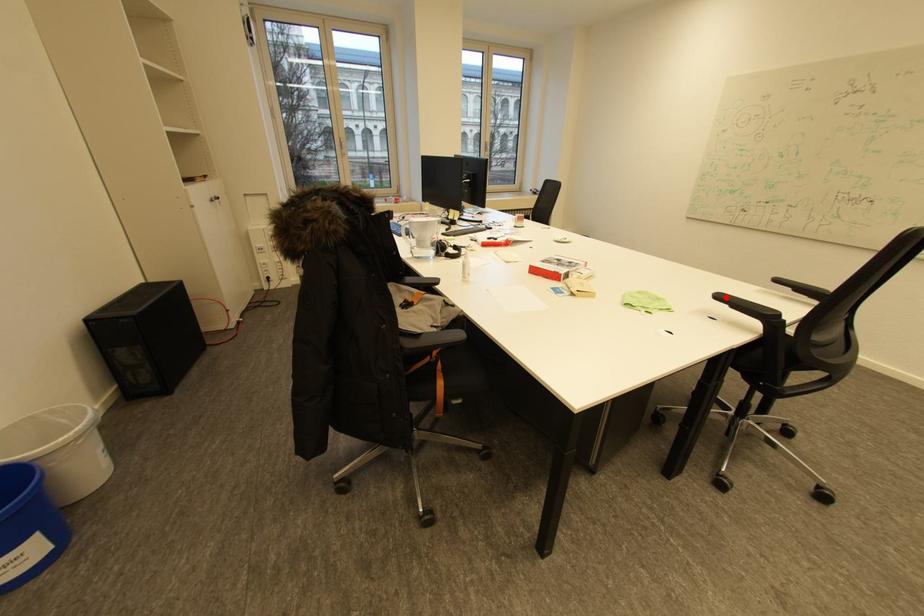
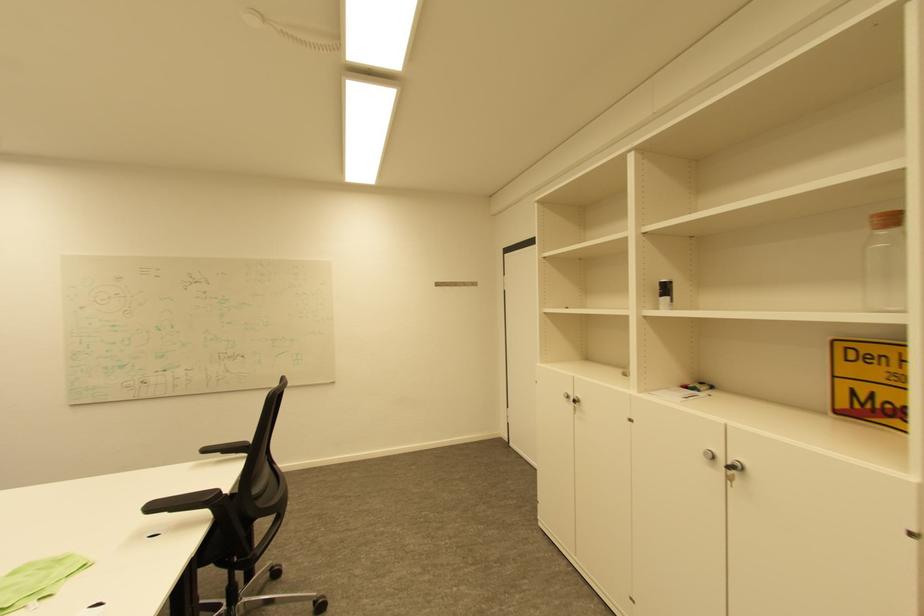
Question: I am providing you with two images of the same scene from different viewpoints. Image1 has a red point marked. In image2, the corresponding 3D location appears at what relative position? Reply with the corresponding letter.

Choices:
 (A) Closer
 (B) Farther

Answer: (A)